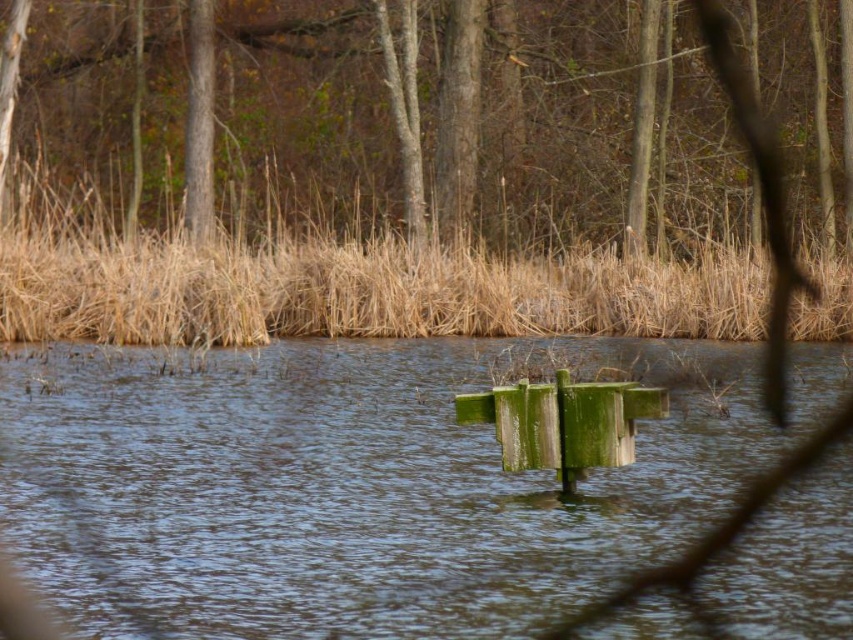
In the scene shown: You are an environmental scientist studying the vegetation in this area. You observe the green mossy wood at center and the brown wood tree at upper center. Which of these two has a smaller diameter?

The green mossy wood at center has a smaller diameter than the brown wood tree at upper center.

You are a kayaker approaching the water area shown in the image. You notice the green mossy wood at center and the brown dry reed at upper center. Which object is closer to you as you paddle towards the scene?

The green mossy wood at center is closer to you because it is in front of the brown dry reed at upper center.

You are standing at the edge of the water and looking out towards the wooden structure. Which of the two points, point (357, 96) or point (360, 269), is closer to you?

Point (357, 96) is closer to you because it is further to the viewer than point (360, 269).